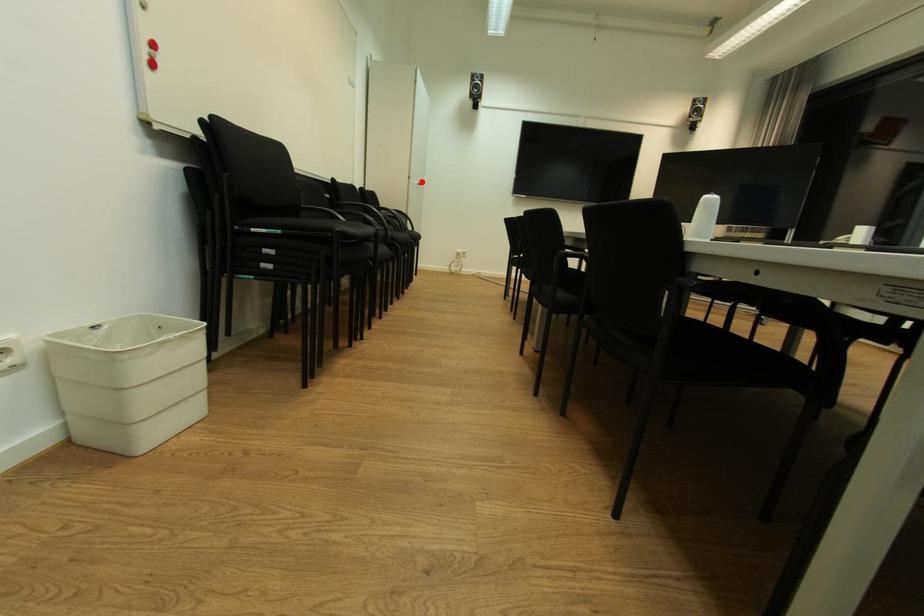
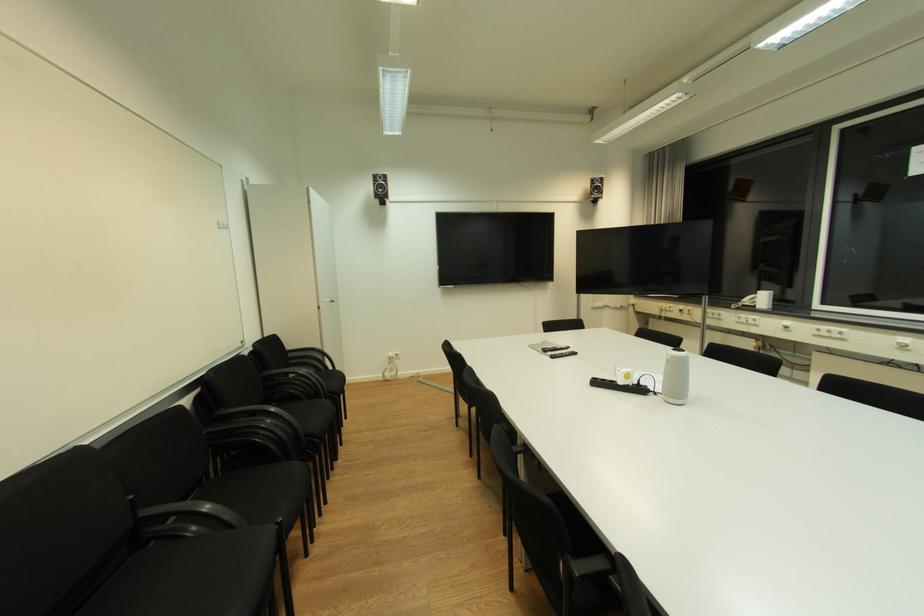
Question: I am providing you with two images of the same scene from different viewpoints. In image1, a red point is highlighted. Considering the same 3D point in image2, which of the following is correct?

Choices:
 (A) It is closer
 (B) It is farther

Answer: (B)